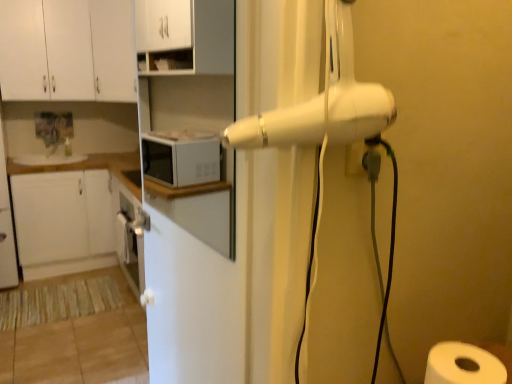
Question: From a real-world perspective, is white glossy screen door at center on top of white paper at lower right?

Choices:
 (A) no
 (B) yes

Answer: (B)

Question: Does white glossy screen door at center appear on the right side of white paper at lower right?

Choices:
 (A) yes
 (B) no

Answer: (B)

Question: Would you say white glossy screen door at center is outside white paper at lower right?

Choices:
 (A) yes
 (B) no

Answer: (A)

Question: From a real-world perspective, is white glossy screen door at center physically below white paper at lower right?

Choices:
 (A) no
 (B) yes

Answer: (A)

Question: Is white glossy screen door at center thinner than white paper at lower right?

Choices:
 (A) no
 (B) yes

Answer: (B)

Question: Is white paper at lower right in front of or behind white matte cabinet at left, the 1th cabinetry from the bottom, in the image?

Choices:
 (A) front
 (B) behind

Answer: (A)

Question: Is point (452, 382) closer or farther from the camera than point (97, 203)?

Choices:
 (A) closer
 (B) farther

Answer: (A)

Question: Based on their positions, is white paper at lower right located to the left or right of white matte cabinet at left, the 1th cabinetry from the bottom?

Choices:
 (A) right
 (B) left

Answer: (A)

Question: From the image's perspective, relative to white matte cabinet at left, the fourth cabinetry when ordered from top to bottom, is white paper at lower right above or below?

Choices:
 (A) below
 (B) above

Answer: (A)

Question: Is white matte cabinet at left, the 1th cabinetry from the bottom, inside the boundaries of white paper at lower right, or outside?

Choices:
 (A) inside
 (B) outside

Answer: (B)

Question: Visually, is white matte cabinet at left, the 1th cabinetry from the bottom, positioned to the left or to the right of white paper at lower right?

Choices:
 (A) right
 (B) left

Answer: (B)

Question: From a real-world perspective, is white matte cabinet at left, the 1th cabinetry from the bottom, physically located above or below white paper at lower right?

Choices:
 (A) below
 (B) above

Answer: (A)

Question: Considering the positions of point (77, 211) and point (480, 349), is point (77, 211) closer or farther from the camera than point (480, 349)?

Choices:
 (A) farther
 (B) closer

Answer: (A)

Question: Do you think white glossy counter top at upper left is within white matte cabinet at left, the fourth cabinetry when ordered from top to bottom, or outside of it?

Choices:
 (A) inside
 (B) outside

Answer: (A)

Question: Based on their positions, is white glossy counter top at upper left located to the left or right of white matte cabinet at left, the fourth cabinetry when ordered from top to bottom?

Choices:
 (A) left
 (B) right

Answer: (A)